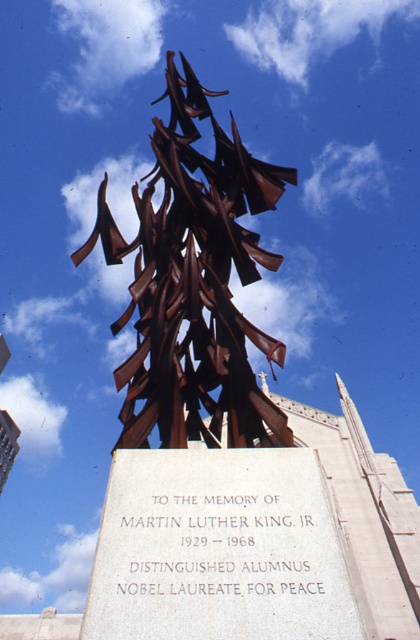
Question: Which object appears closest to the camera in this image?

Choices:
 (A) rusty metal sculpture at center
 (B) white stone plaque at center

Answer: (B)

Question: Can you confirm if white stone plaque at center is positioned to the left of rusty metal sculpture at center?

Choices:
 (A) yes
 (B) no

Answer: (B)

Question: Considering the relative positions of white stone plaque at center and rusty metal sculpture at center in the image provided, where is white stone plaque at center located with respect to rusty metal sculpture at center?

Choices:
 (A) left
 (B) right

Answer: (B)

Question: Which point is farther to the camera?

Choices:
 (A) rusty metal sculpture at center
 (B) white stone plaque at center

Answer: (A)

Question: Observing the image, what is the correct spatial positioning of white stone plaque at center in reference to rusty metal sculpture at center?

Choices:
 (A) above
 (B) below

Answer: (B)